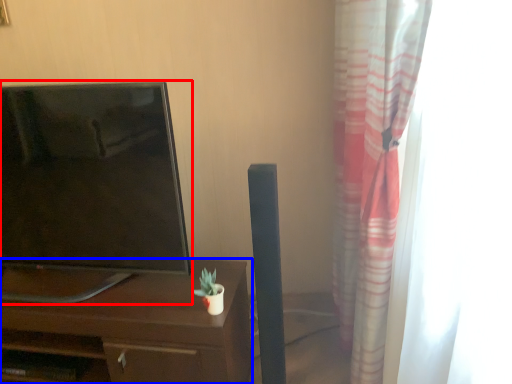
Question: Among these objects, which one is nearest to the camera, television (highlighted by a red box) or desk (highlighted by a blue box)?

Choices:
 (A) television
 (B) desk

Answer: (A)